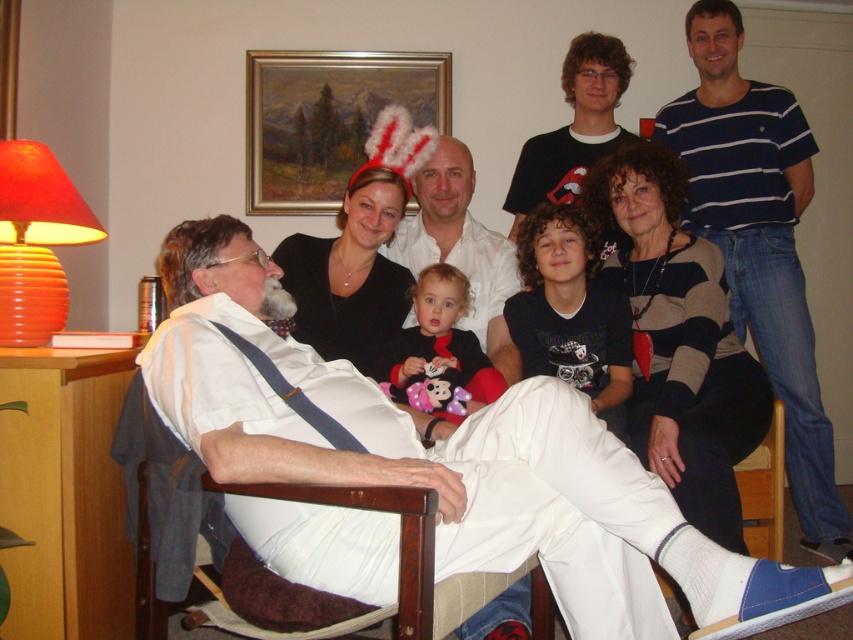
Does blue striped shirt at upper right have a greater width compared to oil painting at upper center?

Incorrect, blue striped shirt at upper right's width does not surpass oil painting at upper center's.

Does blue striped shirt at upper right have a greater height compared to oil painting at upper center?

Correct, blue striped shirt at upper right is much taller as oil painting at upper center.

Which is behind, point (692, 35) or point (422, 120)?

Point (422, 120)

This screenshot has height=640, width=853. In order to click on blue striped shirt at upper right in this screenshot , I will do `click(759, 243)`.

Is the position of wooden armchair at lower left more distant than that of soft plush toy at center?

That is False.

Between point (291, 403) and point (500, 378), which one is positioned in front?

Point (291, 403)

Does point (314, 624) come closer to viewer compared to point (432, 284)?

Yes, it is.

Locate an element on the screen. This screenshot has width=853, height=640. wooden armchair at lower left is located at coordinates (206, 529).

Is point (170, 529) farther from camera compared to point (563, 264)?

No, (170, 529) is closer to viewer.

Which is more to the left, wooden armchair at lower left or black matte shirt at center?

wooden armchair at lower left is more to the left.

Where is `wooden armchair at lower left`? wooden armchair at lower left is located at coordinates (206, 529).